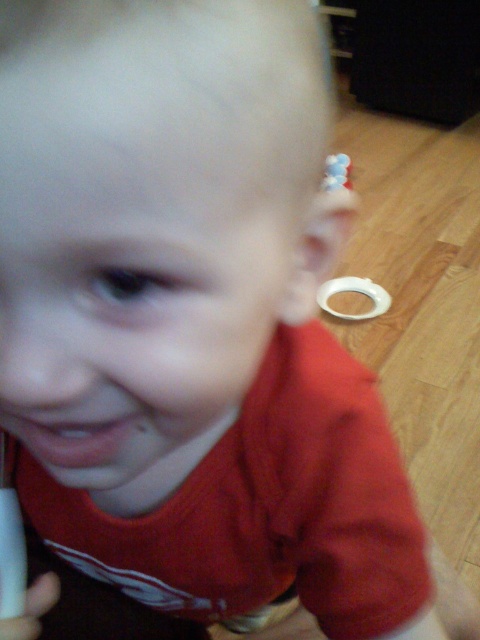
You are a photographer adjusting your camera settings. You notice the pink matte lips at center in the image. Based on their position, can you determine if they are in the upper or lower half of the frame?

Result: The pink matte lips at center are located at point coordinates approximately 0.688 on the x and 0.148 on the y. Since the y coordinate is below 0.5, they are in the lower half of the frame.